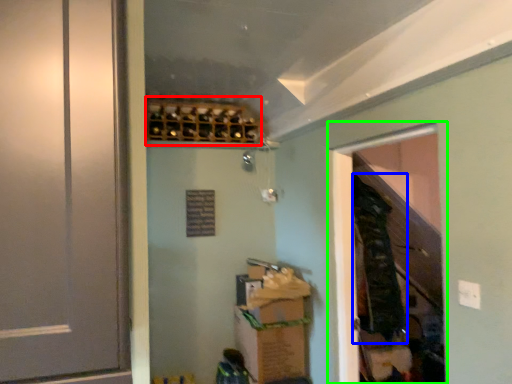
Question: Considering the real-world distances, which object is farthest from wine rack (highlighted by a red box)? laundry (highlighted by a blue box) or screen door (highlighted by a green box)?

Choices:
 (A) laundry
 (B) screen door

Answer: (A)